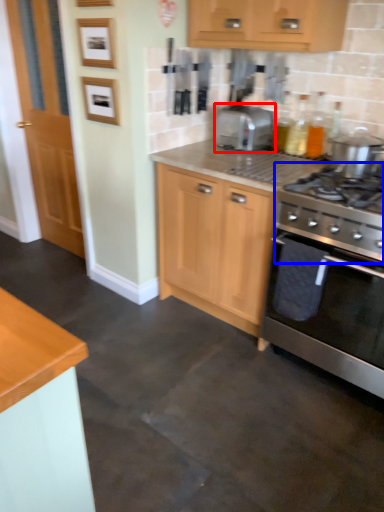
Question: Which object is further to the camera taking this photo, toaster (highlighted by a red box) or gas stove (highlighted by a blue box)?

Choices:
 (A) toaster
 (B) gas stove

Answer: (A)